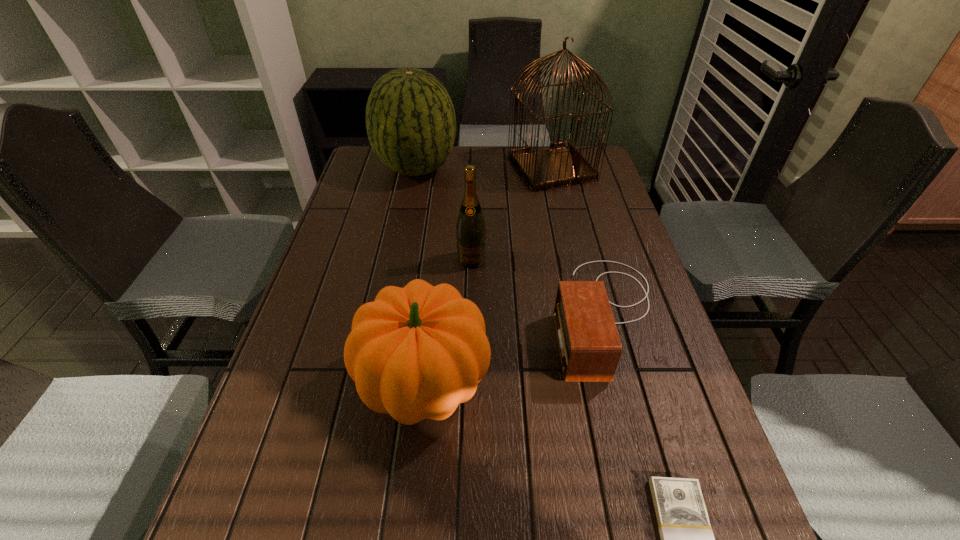
Find the location of a particular element. free space located 0.200m on the front-facing side of the second shortest object is located at coordinates (470, 315).

The height and width of the screenshot is (540, 960). I want to click on vacant space located on the front-facing side of the second shortest object, so click(x=442, y=315).

The height and width of the screenshot is (540, 960). In order to click on birdcage at the far edge in this screenshot , I will do `click(563, 165)`.

Where is `watermelon present at the far edge`? This screenshot has width=960, height=540. watermelon present at the far edge is located at coordinates point(410,119).

At what (x,y) coordinates should I click in order to perform the action: click on object that is at the left edge. Please return your answer as a coordinate pair (x, y). The image size is (960, 540). Looking at the image, I should click on (410, 119).

Find the location of a particular element. birdcage that is positioned at the right edge is located at coordinates (563, 165).

Locate an element on the screen. The width and height of the screenshot is (960, 540). radio receiver located at the right edge is located at coordinates (589, 346).

At what (x,y) coordinates should I click in order to perform the action: click on object at the far left corner. Please return your answer as a coordinate pair (x, y). Looking at the image, I should click on (410, 119).

The height and width of the screenshot is (540, 960). I want to click on object that is at the far right corner, so click(563, 165).

Locate an element on the screen. The image size is (960, 540). free space at the far edge of the desktop is located at coordinates point(507,152).